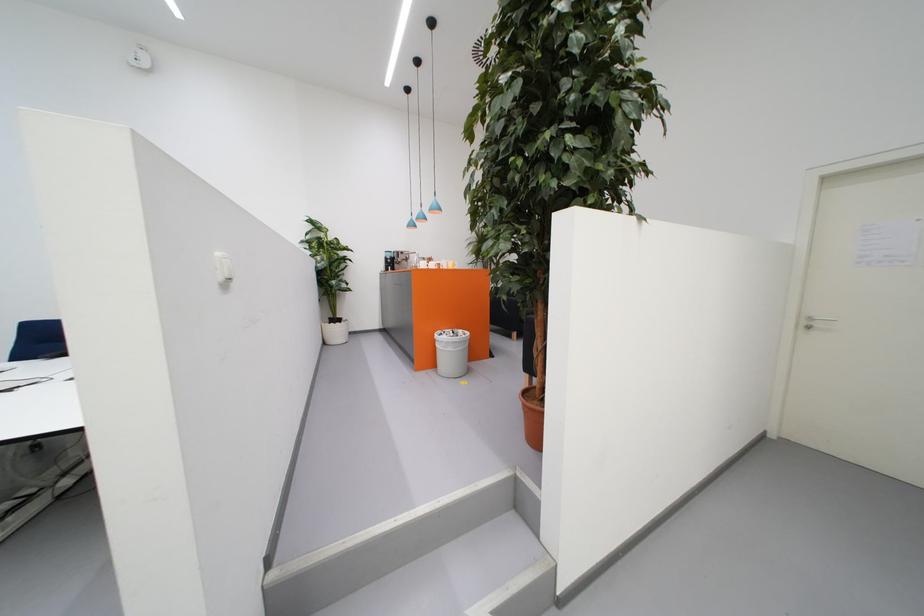
Which object does [334,331] point to?

It corresponds to the small potted plant in the image.